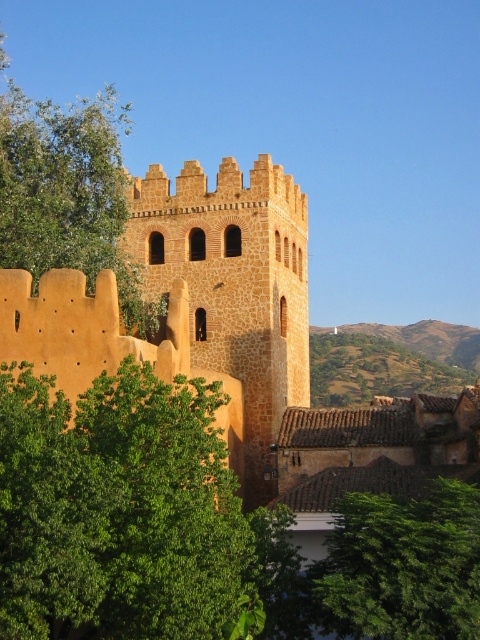
Based on the photo, you are standing at the base of the historic stone tower and want to take a photo of the point at coordinates point (212, 456). If your camera has a maximum focus range of 50 meters, will you be able to capture the point clearly?

The point (212, 456) is 54.06 meters from the camera, which exceeds the maximum focus range of 50 meters. Therefore, the camera cannot capture the point clearly.